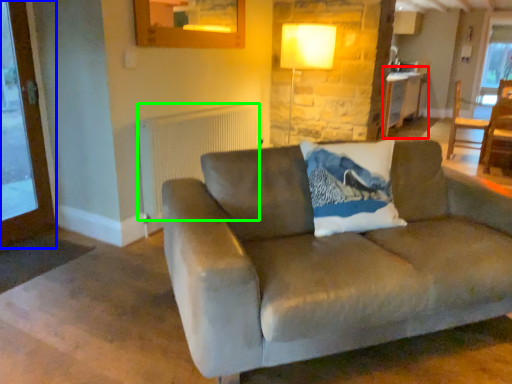
Question: Based on their relative distances, which object is nearer to table (highlighted by a red box)? Choose from screen door (highlighted by a blue box) and radiator (highlighted by a green box).

Choices:
 (A) screen door
 (B) radiator

Answer: (B)